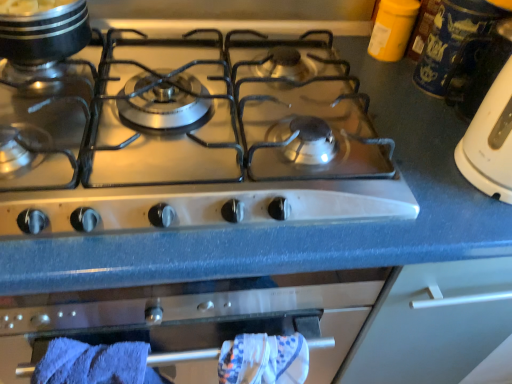
What are the coordinates of `vacant space that's between blue ceramic mug at upper right and satin silver gas stove at center` in the screenshot? It's located at (392, 115).